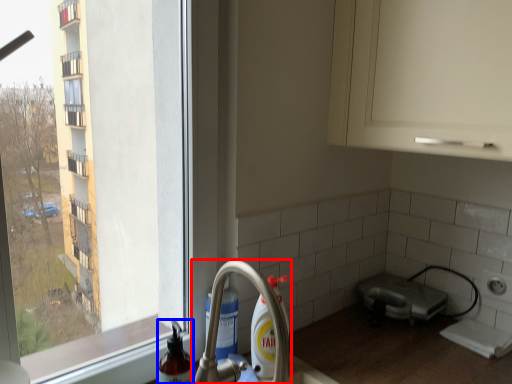
Question: Which point is closer to the camera, tap (highlighted by a red box) or cleaning product (highlighted by a blue box)?

Choices:
 (A) tap
 (B) cleaning product

Answer: (A)